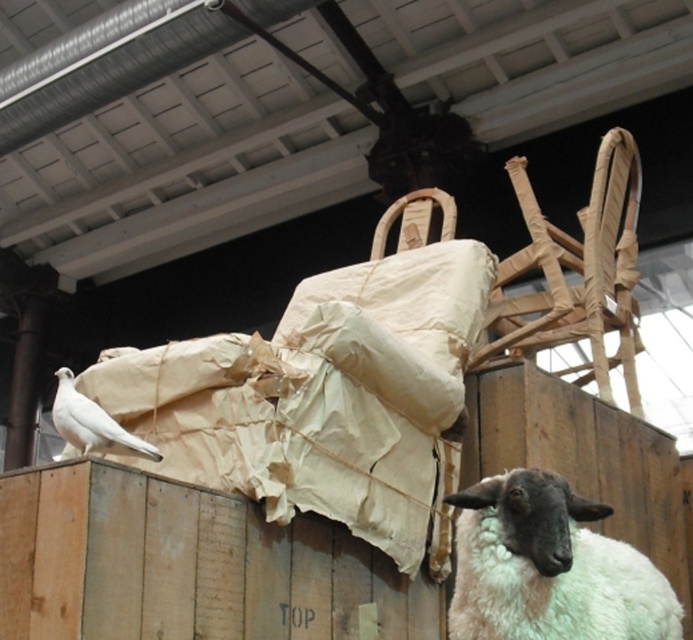
Is white woolen sheep at lower right thinner than white matte dove at left?

In fact, white woolen sheep at lower right might be wider than white matte dove at left.

Between white woolen sheep at lower right and white matte dove at left, which one has more height?

Standing taller between the two is white woolen sheep at lower right.

Between point (511, 637) and point (87, 451), which one is positioned in front?

Positioned in front is point (511, 637).

Locate an element on the screen. white woolen sheep at lower right is located at coordinates (550, 566).